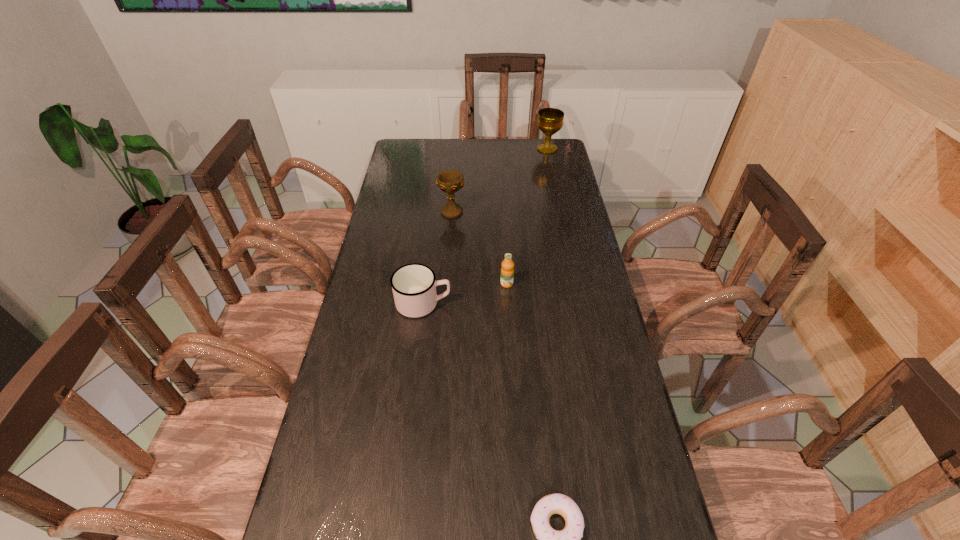
Find the location of a particular element. This screenshot has width=960, height=540. object located in the far edge section of the desktop is located at coordinates (550, 120).

I want to click on object located in the left edge section of the desktop, so click(x=414, y=286).

The height and width of the screenshot is (540, 960). Identify the location of object situated at the right edge. (550, 120).

This screenshot has width=960, height=540. Find the location of `object at the far right corner`. object at the far right corner is located at coordinates (550, 120).

In the image, there is a desktop. Where is `vacant space at the far edge`? This screenshot has height=540, width=960. vacant space at the far edge is located at coordinates (473, 166).

In the image, there is a desktop. Where is `vacant space at the left edge`? The height and width of the screenshot is (540, 960). vacant space at the left edge is located at coordinates (358, 511).

In the image, there is a desktop. Where is `free space at the right edge`? free space at the right edge is located at coordinates (599, 444).

The width and height of the screenshot is (960, 540). In order to click on free space at the far left corner of the desktop in this screenshot , I will do `click(403, 145)`.

In the image, there is a desktop. Find the location of `free space at the far right corner`. free space at the far right corner is located at coordinates tap(559, 139).

In order to click on free space that is in between the orange juice and the second farthest object in this screenshot , I will do click(479, 248).